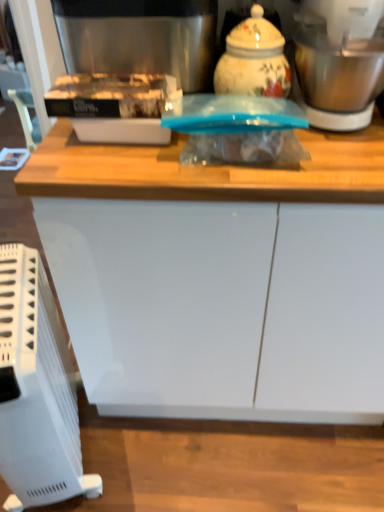
Identify the location of vacant space to the right of white plastic heater at lower left. This screenshot has height=512, width=384. (147, 455).